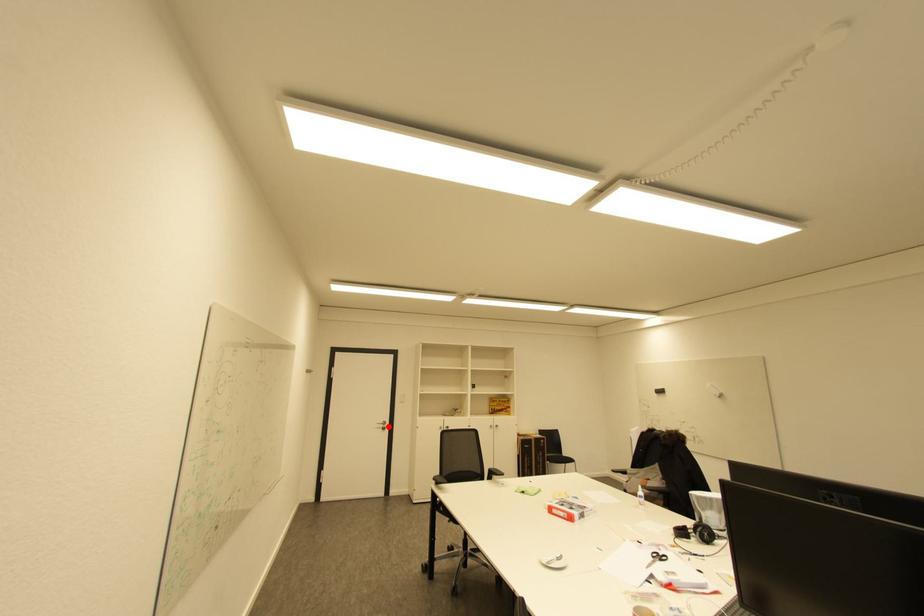
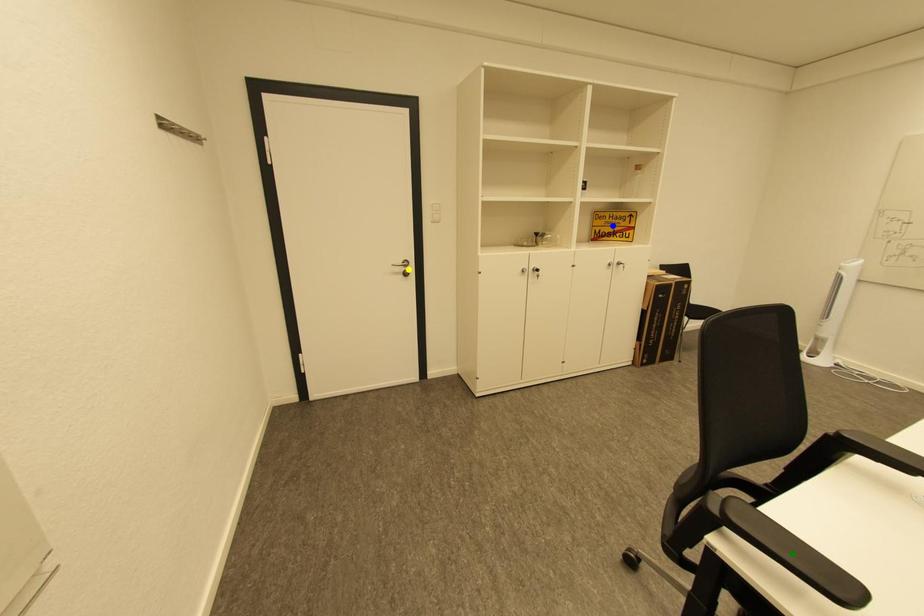
Question: I am providing you with two images of the same scene from different viewpoints. A red point is marked on the first image. You are given multiple points on the second image. In image 2, which mark is for the same physical point as the one in image 1?

Choices:
 (A) green point
 (B) yellow point
 (C) blue point

Answer: (B)